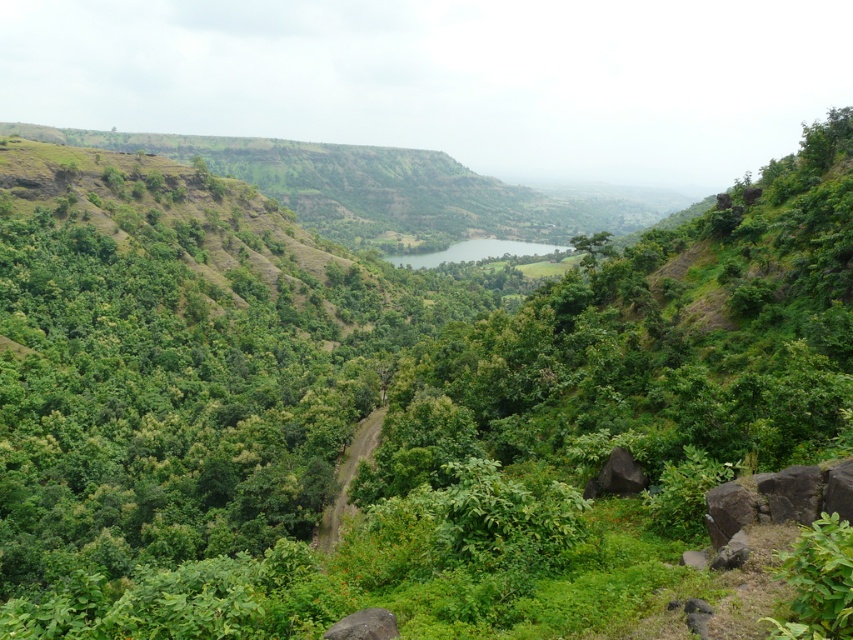
Question: Based on their relative distances, which object is farther from the gray rock at lower center?

Choices:
 (A) green smooth lake at center
 (B) dirt/gravel trail at center

Answer: (A)

Question: Which object is positioned closest to the gray rock at lower center?

Choices:
 (A) dirt/gravel trail at center
 (B) green smooth lake at center

Answer: (A)

Question: Is dirt/gravel trail at center below gray rock at lower center?

Choices:
 (A) yes
 (B) no

Answer: (A)

Question: Observing the image, what is the correct spatial positioning of dirt/gravel trail at center in reference to gray rock at lower center?

Choices:
 (A) left
 (B) right

Answer: (A)

Question: Which object is positioned farthest from the gray rock at lower center?

Choices:
 (A) dirt/gravel trail at center
 (B) green smooth lake at center

Answer: (B)

Question: Is dirt/gravel trail at center bigger than green smooth lake at center?

Choices:
 (A) no
 (B) yes

Answer: (A)